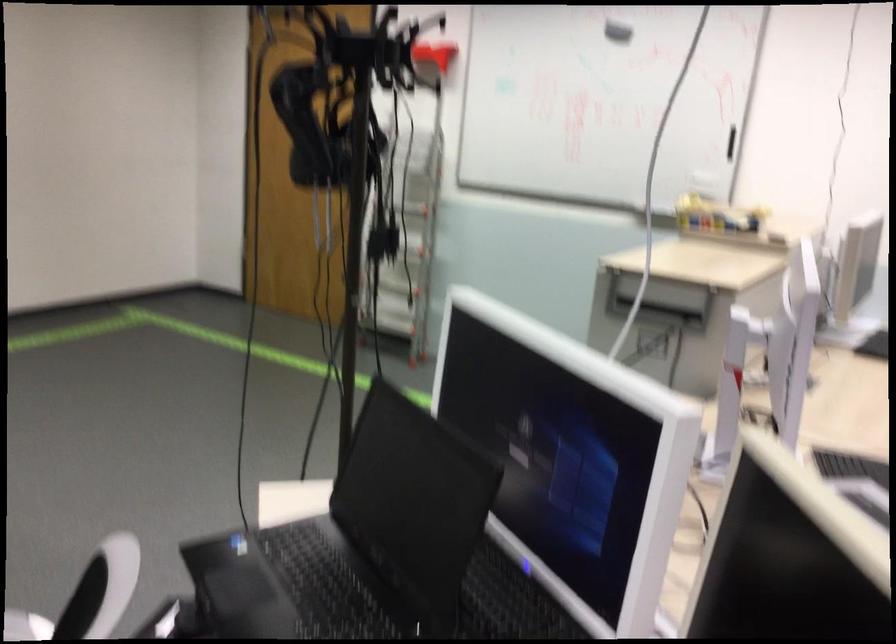
Find where to wip the black whiteboard eraser. Please return your answer as a coordinate pair (x, y).

(617, 32)